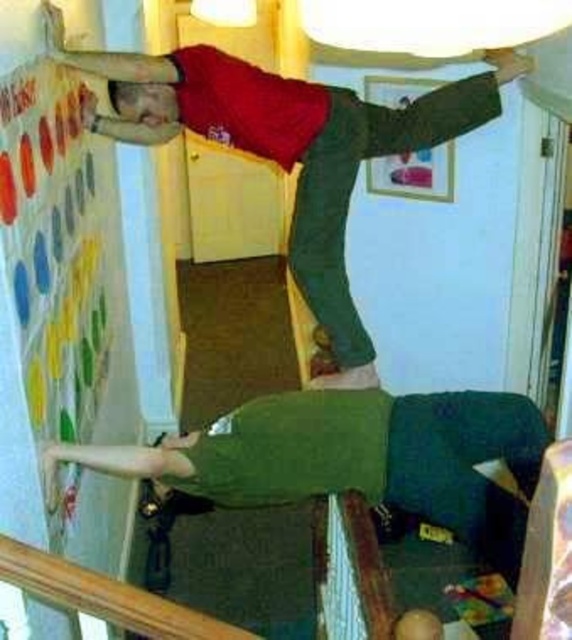
You are a delivery person entering the room and need to place a package on the green fabric couch at lower center and the green matte pants at upper center. Which object should you deliver the package to first based on their positions?

You should deliver the package to the green fabric couch at lower center first because it is closer to you than the green matte pants at upper center.

You are standing in the room where the person is doing a handstand against the wall. You want to sit down on the green fabric couch at lower center. In which direction should you walk from your current position to reach it?

The green fabric couch at lower center is located at point (x=359, y=458) in 2D coordinates. Since the couch is at lower center, you should walk towards the lower part of the room to reach it.

You are trying to hang a small poster on the wall in the room. You see the multicolored fabric bulletin board at upper left and the green matte pants at upper center. Which object is higher up on the wall?

The multicolored fabric bulletin board at upper left is much taller than the green matte pants at upper center, so it is higher up on the wall.